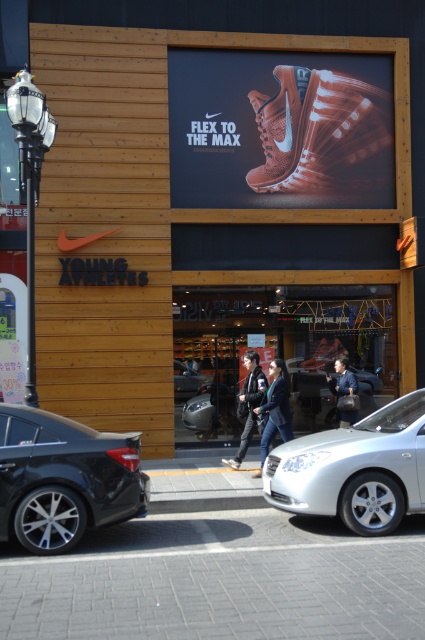
Question: Which point appears farthest from the camera in this image?

Choices:
 (A) (266, 416)
 (B) (388, 212)
 (C) (277, 138)

Answer: (B)

Question: Where is dark blue jeans at center located in relation to dark blue leather jacket at center in the image?

Choices:
 (A) below
 (B) above

Answer: (A)

Question: Is brown mesh shoe at center below white leather shoe at center?

Choices:
 (A) yes
 (B) no

Answer: (B)

Question: Among these objects, which one is farthest from the camera?

Choices:
 (A) wooden signboard at upper center
 (B) dark blue leather jacket at center

Answer: (A)

Question: Can you confirm if silver metallic sedan at center is thinner than metallic silver car at center?

Choices:
 (A) yes
 (B) no

Answer: (B)

Question: Estimate the real-world distances between objects in this image. Which object is farther from the orange mesh shoe at upper center?

Choices:
 (A) dark blue jeans at center
 (B) dark gray fabric jacket at center
 (C) silver metallic sedan at center

Answer: (C)